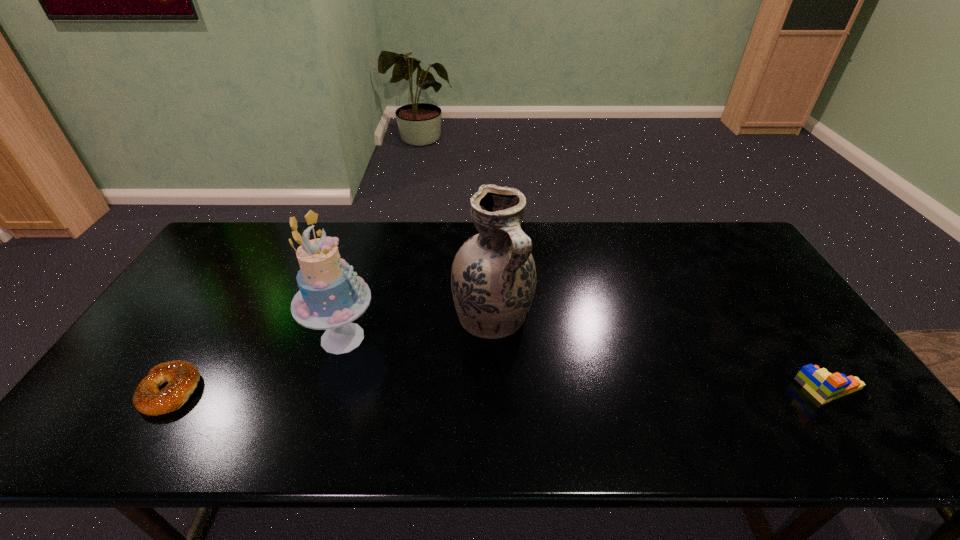
Where is `vacant point located with a ladder on the side of the second object from left to right`? vacant point located with a ladder on the side of the second object from left to right is located at coordinates (416, 376).

This screenshot has height=540, width=960. I want to click on free space located 0.140m with the handle on the side of the vase, so click(546, 382).

Locate an element on the screen. free space located 0.200m with the handle on the side of the vase is located at coordinates (562, 400).

I want to click on free space located 0.160m with the handle on the side of the vase, so click(551, 388).

Identify the location of bagel present at the near edge. Image resolution: width=960 pixels, height=540 pixels. click(x=182, y=377).

Image resolution: width=960 pixels, height=540 pixels. Find the location of `Lego located at the near edge`. Lego located at the near edge is located at coordinates (824, 386).

I want to click on object at the left edge, so click(x=182, y=377).

Locate an element on the screen. The width and height of the screenshot is (960, 540). object that is at the right edge is located at coordinates (824, 386).

Identify the location of object located in the near left corner section of the desktop. Image resolution: width=960 pixels, height=540 pixels. (182, 377).

At what (x,y) coordinates should I click in order to perform the action: click on object that is at the near right corner. Please return your answer as a coordinate pair (x, y). This screenshot has height=540, width=960. Looking at the image, I should click on (824, 386).